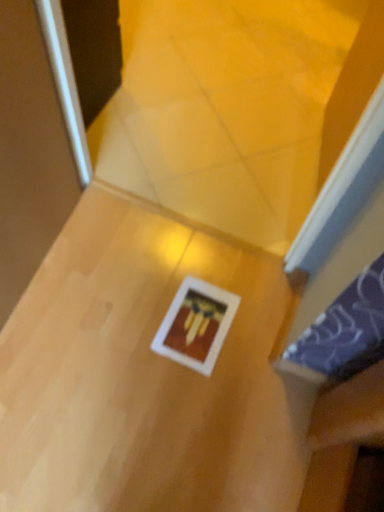
Where is `vacant space to the left of white matte picture frame at center`? The image size is (384, 512). vacant space to the left of white matte picture frame at center is located at coordinates (133, 327).